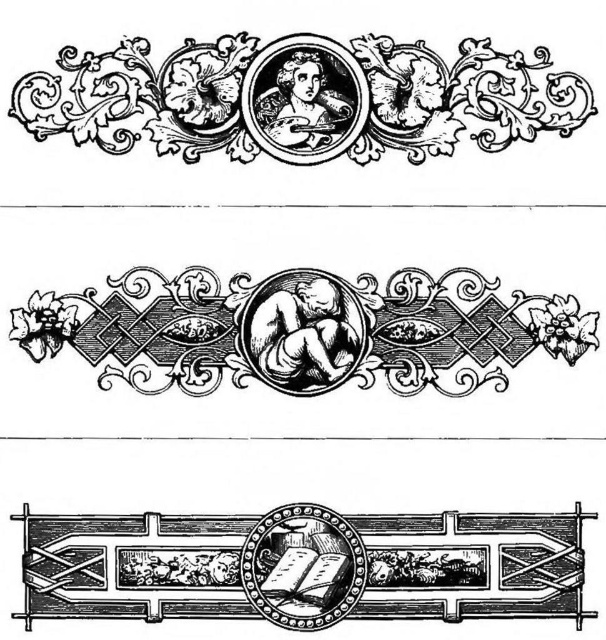
You are an art conservator examining the three borders. The etched wood portrait at upper center and the black ink cherub at center are both central elements. Which of these two has a larger vertical dimension?

The etched wood portrait at upper center has a greater height compared to the black ink cherub at center, so the etched wood portrait at upper center has a larger vertical dimension.

You are an interior designer planning to place the black ink cherub at center and the wooden carved frame at bottom center in a room. Which object should you place closer to the entrance to ensure they are both visible from the doorway?

The black ink cherub at center might be wider than the wooden carved frame at bottom center, so placing the wider object closer to the entrance would make it more visible from the doorway.

What is the position of the point at coordinates (301, 330) in the middle border?

The point at coordinates (301, 330) is located on the black ink cherub at the center of the middle border.